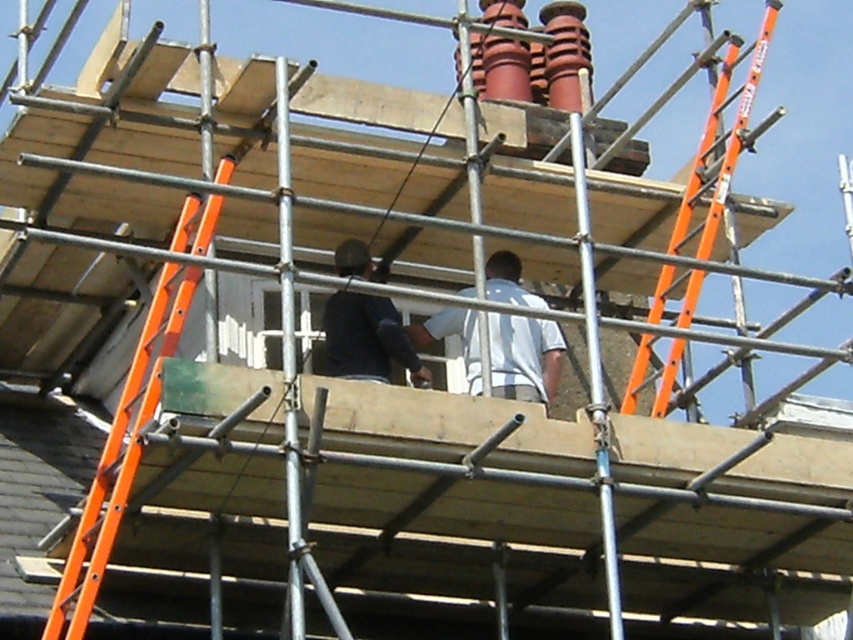
You are a worker on the upper level of the scaffolding and need to reach the ground. The orange metallic ladder at left is your only option. Is the ladder positioned to the left side of the scaffolding?

Yes, the orange metallic ladder at left is located at point (120, 454), which corresponds to the left side of the scaffolding, so it is positioned to the left side.

You are a safety inspector checking the construction site. You notice the orange fiberglass ladder at right and the white matte shirt at center. Which object is bigger in size?

The orange fiberglass ladder at right has a larger size compared to the white matte shirt at center.

You are a construction inspector standing at the base of the scaffolding and need to check two points on the scaffolding structure. The first point is point (756,56) and the second is point (521,291). Which point is closer to you?

Point (756,56) is closer to you because it is further to the viewer than point (521,291).